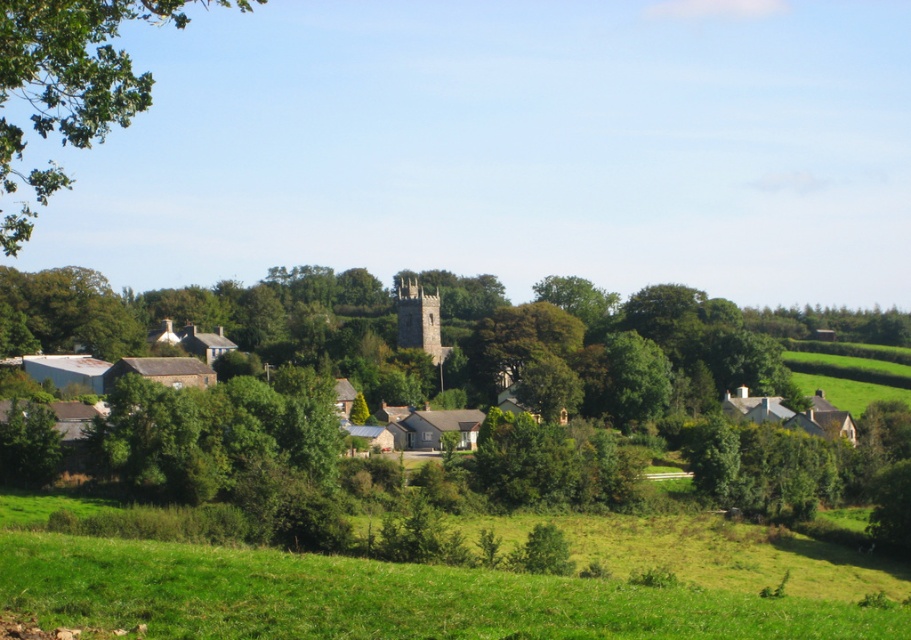
Which is more to the right, green leafy tree at upper left or stone steeple at center?

stone steeple at center is more to the right.

What do you see at coordinates (68, 84) in the screenshot? I see `green leafy tree at upper left` at bounding box center [68, 84].

The image size is (911, 640). Find the location of `green leafy tree at upper left`. green leafy tree at upper left is located at coordinates (68, 84).

Can you confirm if green grassy field at lower center is taller than stone steeple at center?

Incorrect, green grassy field at lower center's height is not larger of stone steeple at center's.

Image resolution: width=911 pixels, height=640 pixels. What do you see at coordinates (379, 596) in the screenshot?
I see `green grassy field at lower center` at bounding box center [379, 596].

Image resolution: width=911 pixels, height=640 pixels. Find the location of `green grassy field at lower center`. green grassy field at lower center is located at coordinates coord(379,596).

Can you confirm if green grassy field at lower center is positioned to the left of green leafy tree at upper left?

In fact, green grassy field at lower center is to the right of green leafy tree at upper left.

Who is positioned more to the right, green grassy field at lower center or green leafy tree at upper left?

green grassy field at lower center

The height and width of the screenshot is (640, 911). Describe the element at coordinates (379, 596) in the screenshot. I see `green grassy field at lower center` at that location.

Find the location of a particular element. Image resolution: width=911 pixels, height=640 pixels. green grassy field at lower center is located at coordinates point(379,596).